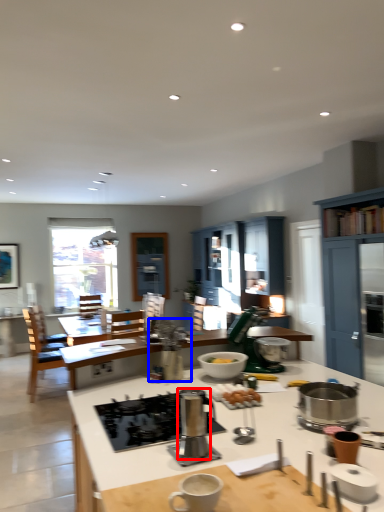
Question: Which object is closer to the camera taking this photo, appliance (highlighted by a red box) or appliance (highlighted by a blue box)?

Choices:
 (A) appliance
 (B) appliance

Answer: (A)